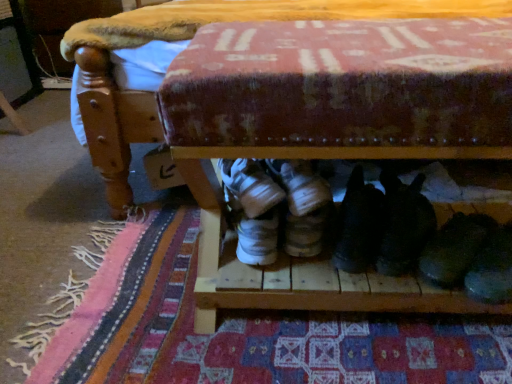
Question: Is shiny black shoe at lower right, which is counted as the 1th footwear, starting from the right, in front of or behind patterned fabric mat at lower center in the image?

Choices:
 (A) front
 (B) behind

Answer: (A)

Question: Looking at the image, does shiny black shoe at lower right, acting as the 4th footwear starting from the left, seem bigger or smaller compared to patterned fabric mat at lower center?

Choices:
 (A) big
 (B) small

Answer: (B)

Question: Estimate the real-world distances between objects in this image. Which object is closer to the black suede shoes at lower right, the third footwear in the left-to-right sequence?

Choices:
 (A) wooden bench at lower center
 (B) black suede shoes at center, which is counted as the 3th footwear, starting from the right
 (C) shiny black shoe at lower right, acting as the 4th footwear starting from the left
 (D) patterned fabric mat at lower center
 (E) white suede sneakers at center, the 1th footwear from the left

Answer: (B)

Question: Based on their relative distances, which object is farther from the patterned fabric mat at lower center?

Choices:
 (A) wooden bench at lower center
 (B) black suede shoes at center, the second footwear when ordered from left to right
 (C) shiny black shoe at lower right, acting as the 4th footwear starting from the left
 (D) white suede sneakers at center, marked as the fourth footwear in a right-to-left arrangement
 (E) black suede shoes at lower right, the second footwear in the right-to-left sequence

Answer: (A)